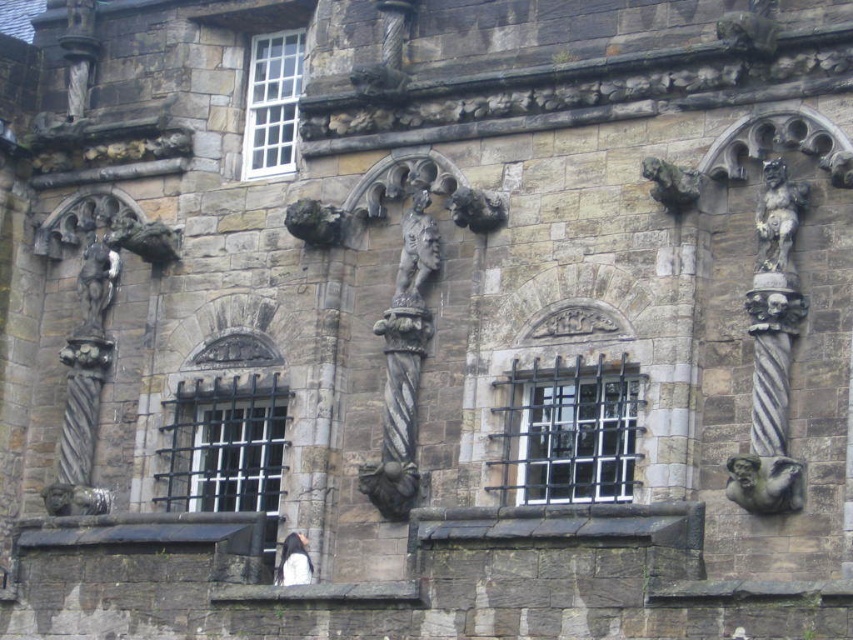
How much distance is there between bronze textured figure at center and white fur at center?

A distance of 28.11 feet exists between bronze textured figure at center and white fur at center.

Is point (432, 244) positioned before point (296, 582)?

No, (432, 244) is behind (296, 582).

Who is more distant from viewer, [422,212] or [292,557]?

The point [422,212] is more distant.

The image size is (853, 640). Find the location of `bronze textured figure at center`. bronze textured figure at center is located at coordinates point(416,252).

Can you confirm if white wooden window at upper center is wider than gray stone gargoyle at center right?

No.

From the picture: Is white wooden window at upper center thinner than gray stone gargoyle at center right?

Yes.

Who is more distant from viewer, (x=286, y=72) or (x=750, y=461)?

Positioned behind is point (x=286, y=72).

Locate an element on the screen. white wooden window at upper center is located at coordinates (271, 104).

Is black metal window at center positioned behind gray stone gargoyle at center right?

Yes, it is.

Does black metal window at center have a lesser height compared to gray stone gargoyle at center right?

In fact, black metal window at center may be taller than gray stone gargoyle at center right.

In order to click on black metal window at center in this screenshot , I will do `click(572, 432)`.

I want to click on black metal window at center, so click(x=572, y=432).